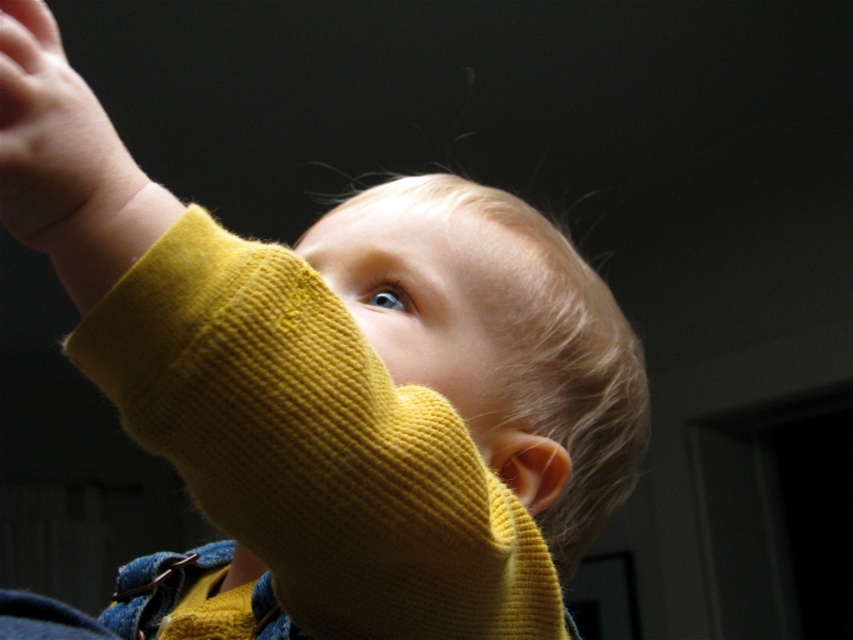
Does smooth yellow sweater at center appear on the left side of smooth yellow sleeve at upper left?

No, smooth yellow sweater at center is not to the left of smooth yellow sleeve at upper left.

Can you confirm if smooth yellow sweater at center is positioned below smooth yellow sleeve at upper left?

Indeed, smooth yellow sweater at center is positioned under smooth yellow sleeve at upper left.

Between point (479, 396) and point (12, 177), which one is positioned behind?

Positioned behind is point (479, 396).

The width and height of the screenshot is (853, 640). Identify the location of smooth yellow sweater at center. [x=436, y=301].